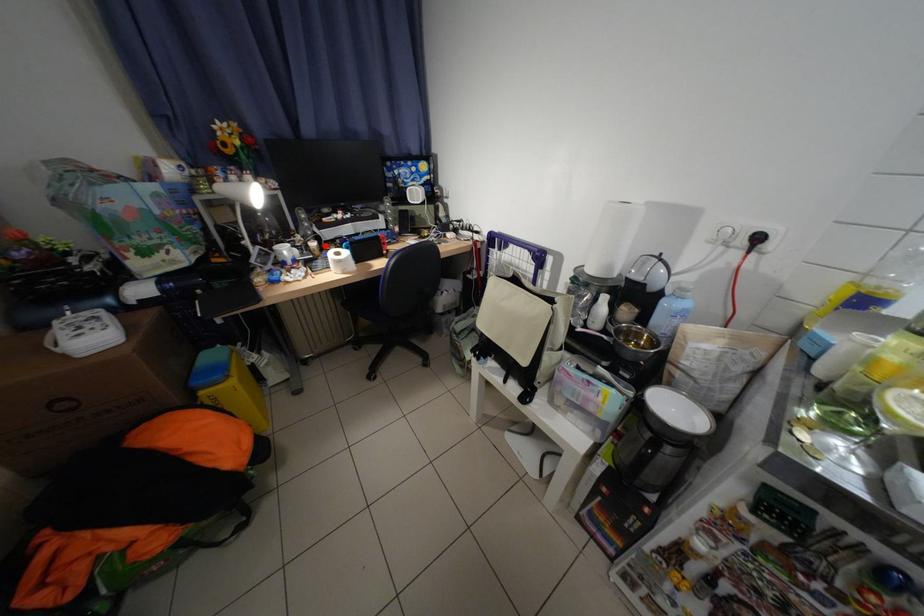
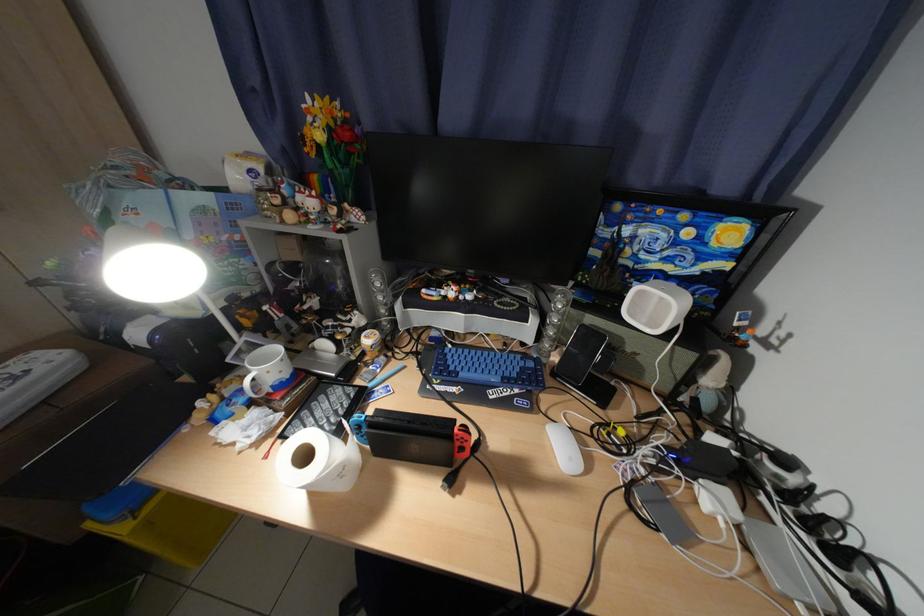
In the second image, find the point that corresponds to the highlighted location in the first image.

(381, 341)